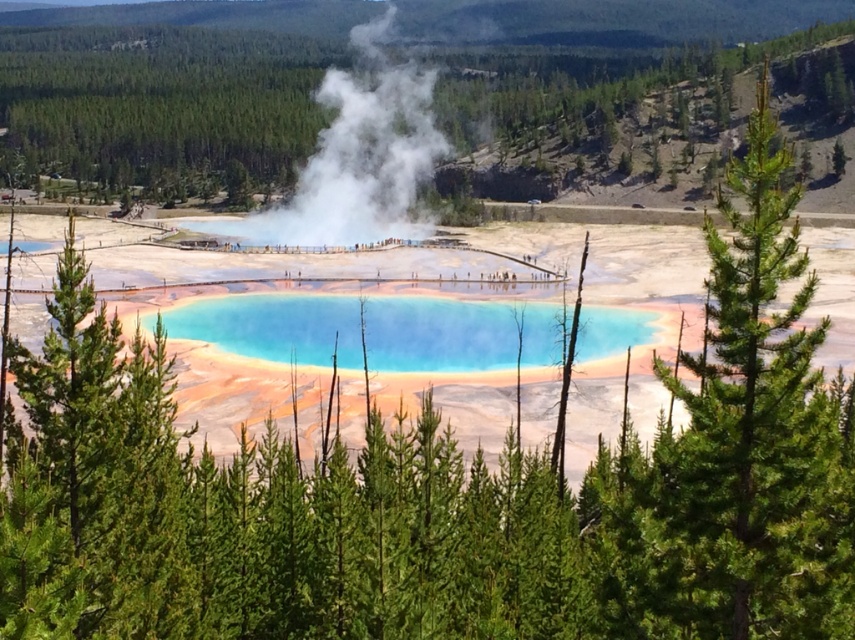
Question: In this image, where is translucent blue water at center located relative to white vapor at center?

Choices:
 (A) right
 (B) left

Answer: (A)

Question: Is green leafy tree at upper center positioned in front of translucent blue water at center?

Choices:
 (A) no
 (B) yes

Answer: (A)

Question: Is green leafy tree at upper center wider than translucent blue water at center?

Choices:
 (A) no
 (B) yes

Answer: (B)

Question: Based on their relative distances, which object is nearer to the translucent blue water at center?

Choices:
 (A) white vapor at center
 (B) green leafy tree at upper center

Answer: (A)

Question: Which of the following is the farthest from the observer?

Choices:
 (A) (705, 77)
 (B) (382, 97)
 (C) (540, 324)

Answer: (B)

Question: Which of the following is the closest to the observer?

Choices:
 (A) white vapor at center
 (B) translucent blue water at center

Answer: (B)